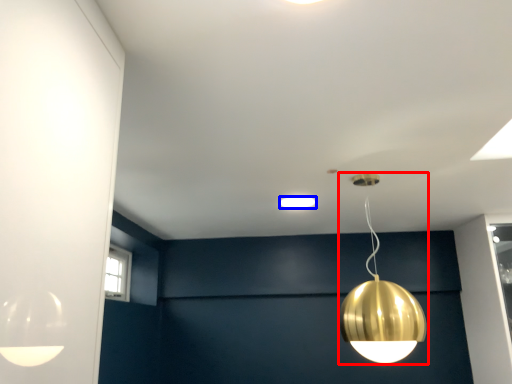
Question: Which of the following is the farthest to the observer, lamp (highlighted by a red box) or lamp (highlighted by a blue box)?

Choices:
 (A) lamp
 (B) lamp

Answer: (B)